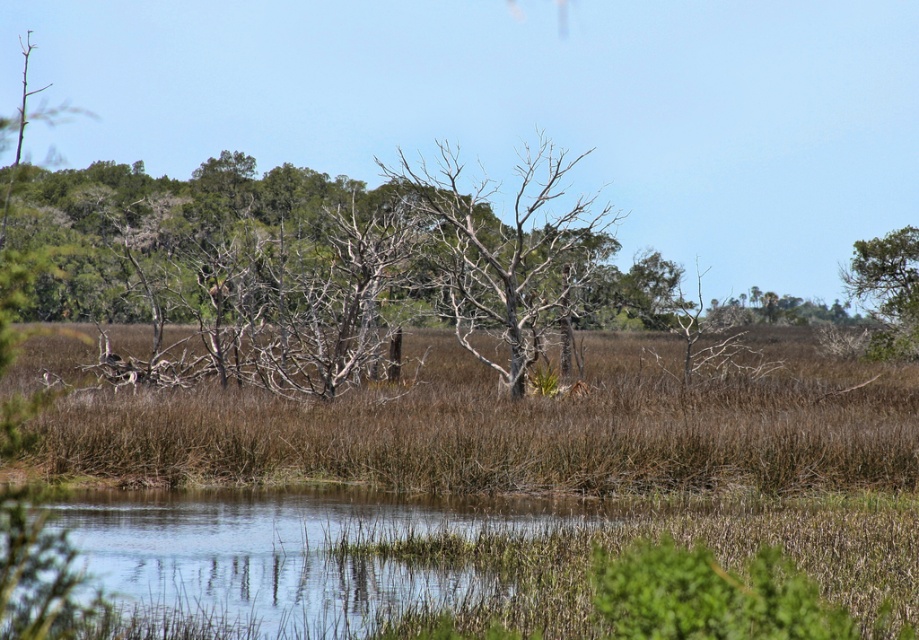
You are standing at the edge of the wetland and see a point marked at coordinates (506,248). What object is located at that point?

The point at coordinates (506,248) indicates a bare wood tree at center.

You are a bird looking for a nesting spot. You see a bare wood tree at center and a green leafy tree at upper right. Which tree is taller and better for nesting?

The bare wood tree at center is much taller than the green leafy tree at upper right, making it a better option for nesting due to its height providing better visibility and safety.

You are standing in a wetland area and want to take a photo of the bare wood tree at center. If your camera has a maximum zoom range of 20 meters, will you be able to capture a clear closeup of the tree without moving closer?

The distance between the bare wood tree at center and the viewer is 23.84 meters, which exceeds the camera maximum zoom range of 20 meters. Therefore, you cannot capture a clear closeup without moving closer.